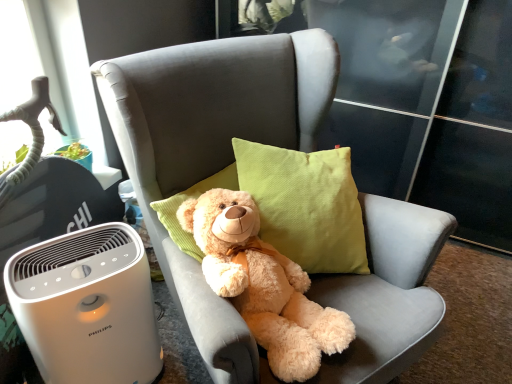
Question: From the image's perspective, is fluffy beige teddy bear at center under white plastic air purifier at lower left?

Choices:
 (A) yes
 (B) no

Answer: (B)

Question: Is fluffy beige teddy bear at center behind white plastic air purifier at lower left?

Choices:
 (A) no
 (B) yes

Answer: (A)

Question: Is fluffy beige teddy bear at center not inside white plastic air purifier at lower left?

Choices:
 (A) no
 (B) yes

Answer: (B)

Question: Considering the relative positions of fluffy beige teddy bear at center and white plastic air purifier at lower left in the image provided, is fluffy beige teddy bear at center to the left of white plastic air purifier at lower left from the viewer's perspective?

Choices:
 (A) no
 (B) yes

Answer: (A)

Question: Can you confirm if fluffy beige teddy bear at center is thinner than white plastic air purifier at lower left?

Choices:
 (A) yes
 (B) no

Answer: (B)

Question: Is fluffy beige teddy bear at center surrounding white plastic air purifier at lower left?

Choices:
 (A) yes
 (B) no

Answer: (B)

Question: Is fluffy beige teddy bear at center positioned before soft gray fabric chair at center?

Choices:
 (A) no
 (B) yes

Answer: (A)

Question: Can you confirm if fluffy beige teddy bear at center is smaller than soft gray fabric chair at center?

Choices:
 (A) yes
 (B) no

Answer: (A)

Question: Is fluffy beige teddy bear at center bigger than soft gray fabric chair at center?

Choices:
 (A) no
 (B) yes

Answer: (A)

Question: Is the surface of fluffy beige teddy bear at center in direct contact with soft gray fabric chair at center?

Choices:
 (A) yes
 (B) no

Answer: (B)

Question: Can you confirm if fluffy beige teddy bear at center is wider than soft gray fabric chair at center?

Choices:
 (A) no
 (B) yes

Answer: (A)

Question: From a real-world perspective, is fluffy beige teddy bear at center located higher than soft gray fabric chair at center?

Choices:
 (A) yes
 (B) no

Answer: (A)

Question: Is white plastic air purifier at lower left not close to soft gray fabric chair at center?

Choices:
 (A) yes
 (B) no

Answer: (B)